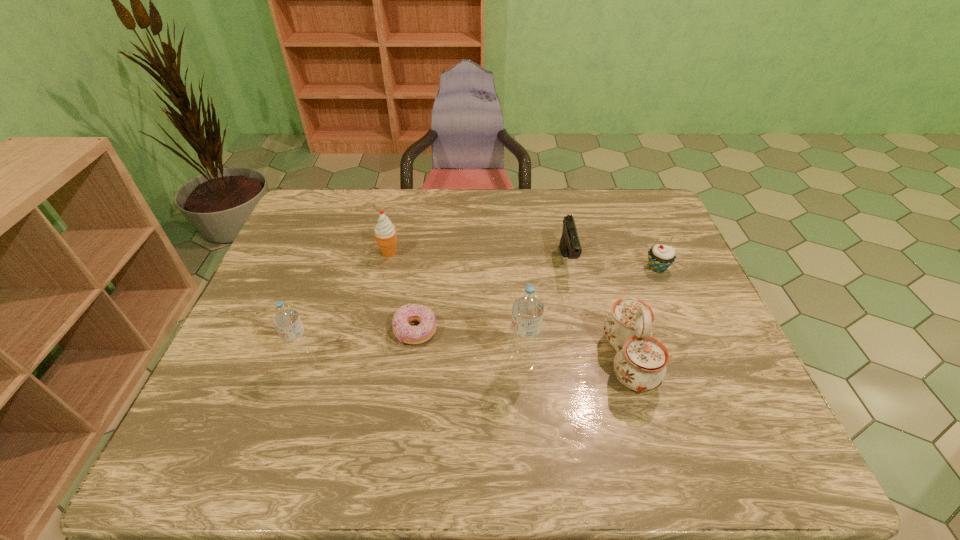
The width and height of the screenshot is (960, 540). I want to click on the leftmost object, so click(285, 317).

Locate an element on the screen. The width and height of the screenshot is (960, 540). the left water bottle is located at coordinates (285, 317).

Find the location of a particular element. This screenshot has width=960, height=540. the fourth object from right to left is located at coordinates (528, 306).

In order to click on the right water bottle in this screenshot , I will do `click(528, 306)`.

Where is `icecream`? icecream is located at coordinates (385, 232).

Identify the location of pistol. (570, 246).

You are a GUI agent. You are given a task and a screenshot of the screen. Output one action in this format:
    pyautogui.click(x=<x>, y=<y>)
    Task: Click on the doughnut
    
    Given the screenshot: What is the action you would take?
    coord(404,332)

This screenshot has width=960, height=540. I want to click on the shortest object, so click(404, 332).

The width and height of the screenshot is (960, 540). Find the location of `cupcake`. cupcake is located at coordinates (x=660, y=257).

Identify the location of chinaware. (640, 362).